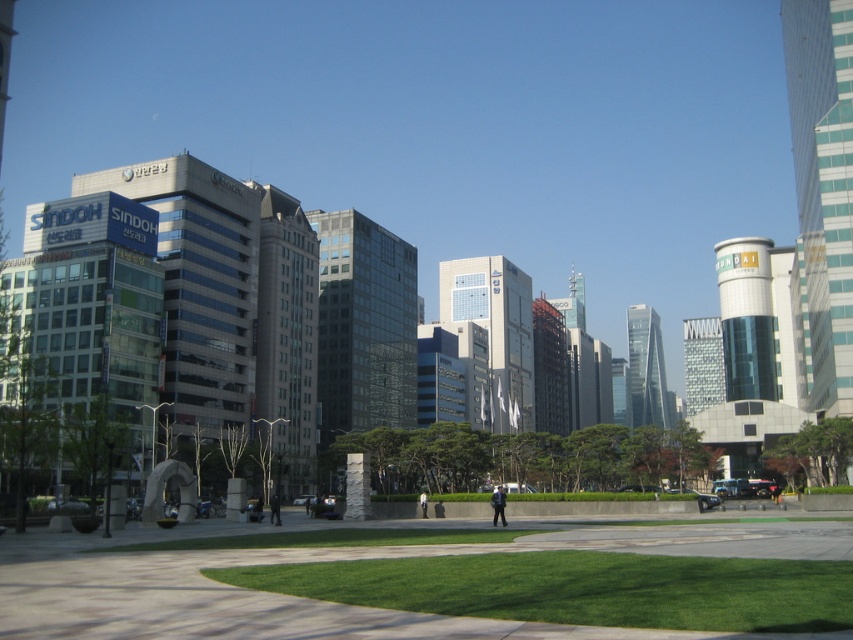
Between dark gray jacket at center and white fabric person at center, which one has more height?

Standing taller between the two is dark gray jacket at center.

The width and height of the screenshot is (853, 640). I want to click on dark gray jacket at center, so click(274, 508).

Looking at this image, is dark blue uniform at center shorter than dark blue jeans at center?

No, dark blue uniform at center is not shorter than dark blue jeans at center.

The image size is (853, 640). Identify the location of dark blue uniform at center. (498, 504).

Identify the location of dark blue uniform at center. The height and width of the screenshot is (640, 853). (498, 504).

Is point (273, 518) farther from camera compared to point (259, 518)?

No, it is in front of (259, 518).

Image resolution: width=853 pixels, height=640 pixels. Describe the element at coordinates (274, 508) in the screenshot. I see `dark gray jacket at center` at that location.

Where is `dark gray jacket at center`? The height and width of the screenshot is (640, 853). dark gray jacket at center is located at coordinates (274, 508).